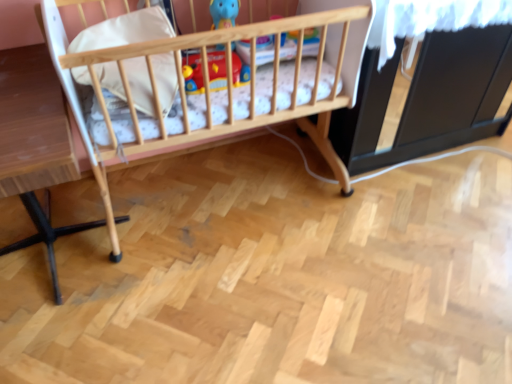
Question: Is white soft pillow at upper left behind wooden crib at center?

Choices:
 (A) no
 (B) yes

Answer: (B)

Question: From a real-world perspective, is white soft pillow at upper left over wooden crib at center?

Choices:
 (A) yes
 (B) no

Answer: (A)

Question: Is white soft pillow at upper left in front of wooden crib at center?

Choices:
 (A) no
 (B) yes

Answer: (A)

Question: Considering the relative sizes of white soft pillow at upper left and wooden crib at center in the image provided, is white soft pillow at upper left bigger than wooden crib at center?

Choices:
 (A) no
 (B) yes

Answer: (A)

Question: Can you confirm if white soft pillow at upper left is positioned to the right of wooden crib at center?

Choices:
 (A) yes
 (B) no

Answer: (B)

Question: Is white soft pillow at upper left located outside wooden crib at center?

Choices:
 (A) yes
 (B) no

Answer: (B)

Question: Is white soft pillow at upper left inside wooden crib at center?

Choices:
 (A) no
 (B) yes

Answer: (B)

Question: Is wooden crib at center facing towards white soft pillow at upper left?

Choices:
 (A) yes
 (B) no

Answer: (A)

Question: Does wooden crib at center have a larger size compared to white soft pillow at upper left?

Choices:
 (A) no
 (B) yes

Answer: (B)

Question: Is there a large distance between wooden crib at center and white soft pillow at upper left?

Choices:
 (A) no
 (B) yes

Answer: (A)

Question: Is wooden crib at center facing away from white soft pillow at upper left?

Choices:
 (A) no
 (B) yes

Answer: (B)

Question: Considering the relative sizes of wooden crib at center and white soft pillow at upper left in the image provided, is wooden crib at center wider than white soft pillow at upper left?

Choices:
 (A) no
 (B) yes

Answer: (B)

Question: Can you confirm if light brown wooden table at left is taller than wooden crib at center?

Choices:
 (A) yes
 (B) no

Answer: (B)